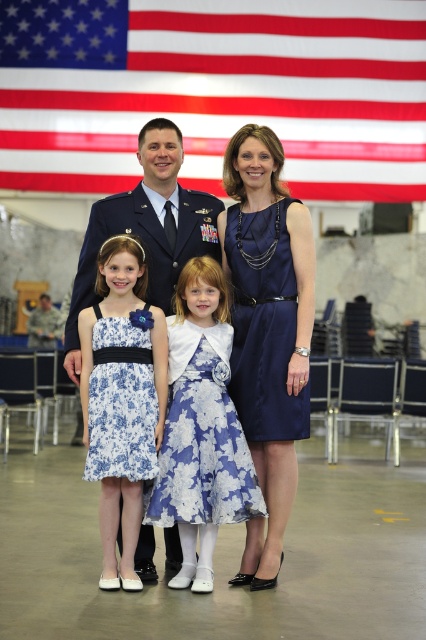
Is floral dress at center below floral satin dress at center?

Actually, floral dress at center is above floral satin dress at center.

Does floral dress at center appear on the right side of floral satin dress at center?

Correct, you'll find floral dress at center to the right of floral satin dress at center.

Find the location of a particular element. This screenshot has height=640, width=426. floral dress at center is located at coordinates (271, 324).

Find the location of a particular element. floral dress at center is located at coordinates (271, 324).

Which is below, floral dress at center or blue floral dress at center?

Positioned lower is blue floral dress at center.

Does point (288, 218) come closer to viewer compared to point (120, 336)?

No, it is behind (120, 336).

Does point (256, 170) come closer to viewer compared to point (141, 500)?

That is False.

This screenshot has height=640, width=426. What are the coordinates of `floral dress at center` in the screenshot? It's located at tap(271, 324).

What do you see at coordinates (216, 90) in the screenshot?
I see `red/white striped fabric at upper center` at bounding box center [216, 90].

Where is `red/white striped fabric at upper center`? The width and height of the screenshot is (426, 640). red/white striped fabric at upper center is located at coordinates (216, 90).

I want to click on red/white striped fabric at upper center, so click(x=216, y=90).